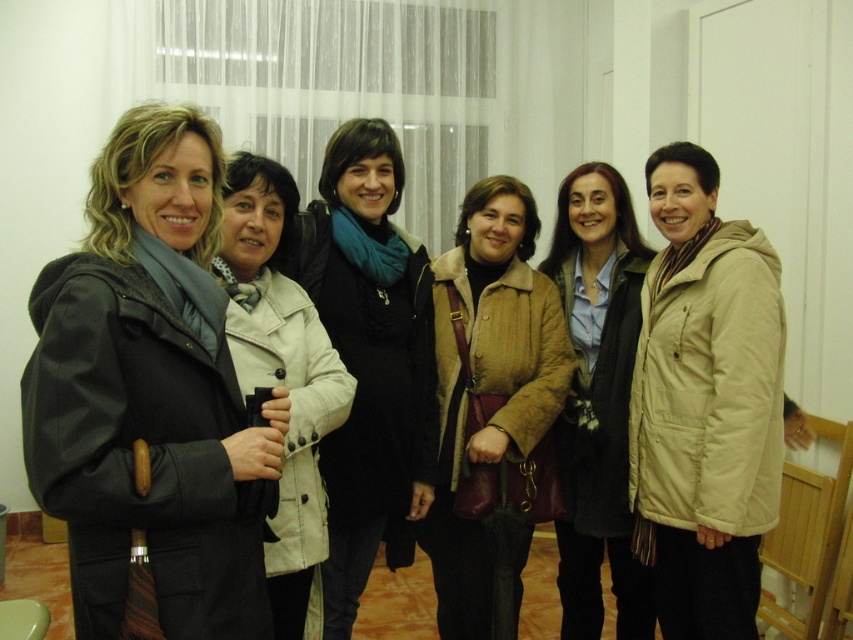
Question: Which point is farther from the camera taking this photo?

Choices:
 (A) (502, 532)
 (B) (589, 467)

Answer: (B)

Question: Is beige cotton jacket at center above beige fabric coat at center?

Choices:
 (A) no
 (B) yes

Answer: (A)

Question: Which point is farther from the camera taking this photo?

Choices:
 (A) (593, 598)
 (B) (730, 582)

Answer: (A)

Question: Which point is closer to the camera taking this photo?

Choices:
 (A) (482, 596)
 (B) (641, 260)
 (C) (250, 368)

Answer: (C)

Question: Is beige cotton jacket at center below beige fabric coat at center?

Choices:
 (A) no
 (B) yes

Answer: (B)

Question: Is tan quilted jacket at center in front of blue scarf at center?

Choices:
 (A) yes
 (B) no

Answer: (B)